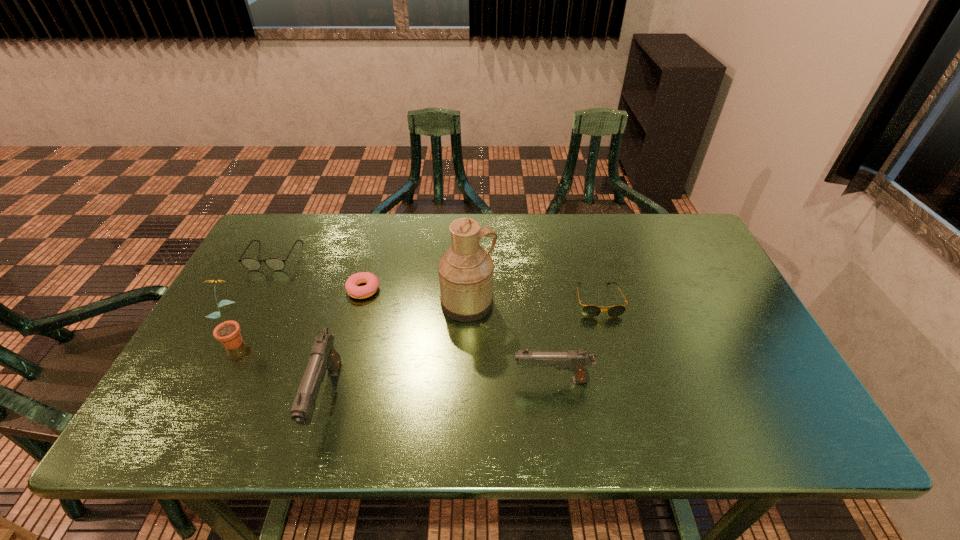
Identify the location of free area in between the right gun and the second tallest object. (394, 359).

The height and width of the screenshot is (540, 960). What are the coordinates of `unoccupied position between the left gun and the sunflower` in the screenshot? It's located at (281, 368).

The width and height of the screenshot is (960, 540). I want to click on free point between the fifth shortest object and the rightmost object, so click(462, 350).

Find the location of a particular element. The width and height of the screenshot is (960, 540). free space that is in between the sixth shortest object and the farthest object is located at coordinates (255, 296).

Where is `unoccupied area between the pitcher and the doughnut`? Image resolution: width=960 pixels, height=540 pixels. unoccupied area between the pitcher and the doughnut is located at coordinates (x=416, y=296).

Image resolution: width=960 pixels, height=540 pixels. In order to click on free spot between the fifth farthest object and the shortest object in this screenshot , I will do `click(300, 314)`.

Locate an element on the screen. The height and width of the screenshot is (540, 960). vacant point located between the tallest object and the sunglasses is located at coordinates (533, 302).

In order to click on free space between the rightmost object and the sunflower in this screenshot , I will do `click(417, 319)`.

The width and height of the screenshot is (960, 540). Identify the location of free space between the third tallest object and the fourth shortest object. (439, 390).

Identify which object is the fourth nearest to the shorter gun. Please provide its 2D coordinates. Your answer should be formatted as a tuple, i.e. [(x, y)], where the tuple contains the x and y coordinates of a point satisfying the conditions above.

[(358, 292)]